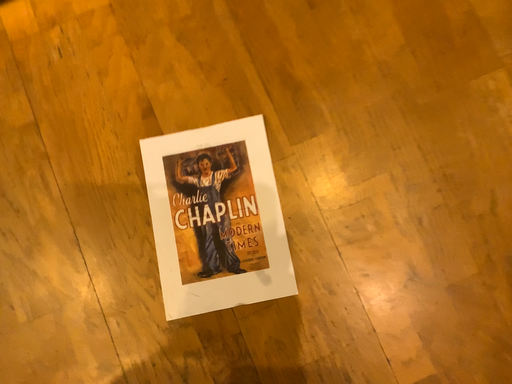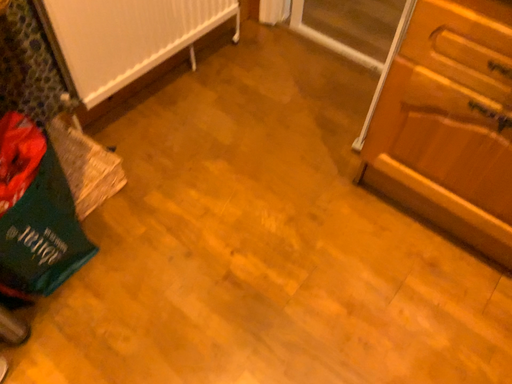
Question: Which way did the camera rotate in the video?

Choices:
 (A) rotated left
 (B) rotated right

Answer: (B)